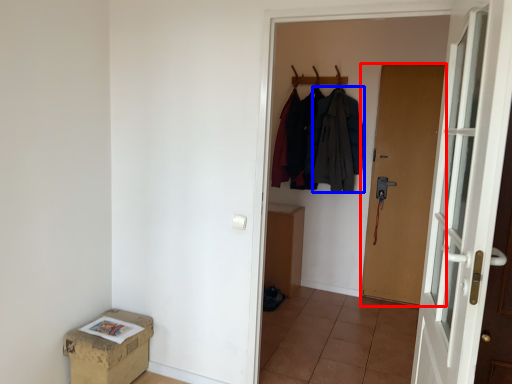
Question: Which point is further to the camera, door (highlighted by a red box) or clothing (highlighted by a blue box)?

Choices:
 (A) door
 (B) clothing

Answer: (B)